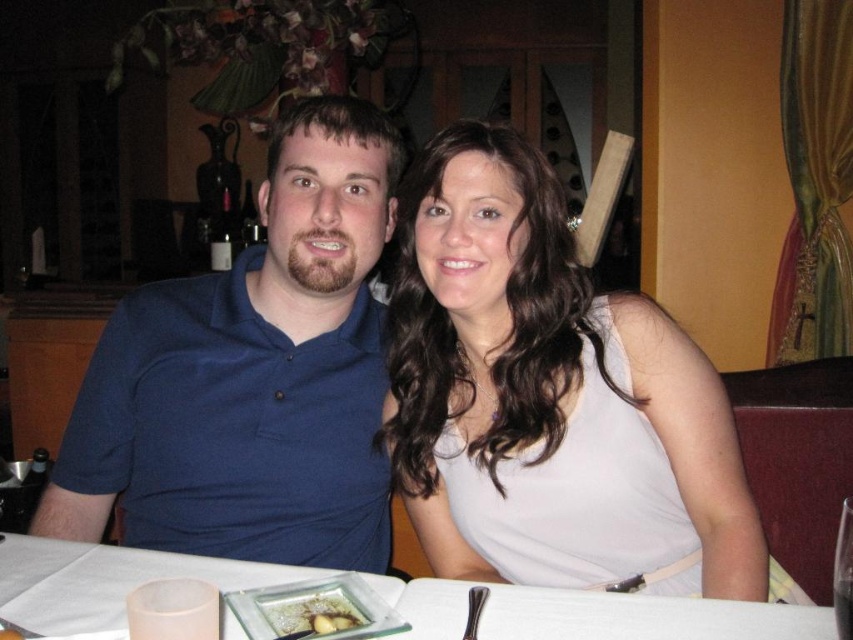
Question: Does slightly browned bread at center appear on the left side of transparent glass at table center?

Choices:
 (A) yes
 (B) no

Answer: (A)

Question: Considering the relative positions of matte white dress at center and white paper napkin at center in the image provided, where is matte white dress at center located with respect to white paper napkin at center?

Choices:
 (A) left
 (B) right

Answer: (B)

Question: Is blue cotton shirt at upper left bigger than white paper napkin at center?

Choices:
 (A) yes
 (B) no

Answer: (A)

Question: Among these objects, which one is farthest from the camera?

Choices:
 (A) white paper napkin at center
 (B) matte white dress at center
 (C) blue cotton polo shirt at left

Answer: (C)

Question: Which object is farther from the camera taking this photo?

Choices:
 (A) white paper napkin at center
 (B) slightly browned bread at center
 (C) blue cotton shirt at upper left

Answer: (C)

Question: Which object is farther from the camera taking this photo?

Choices:
 (A) white paper napkin at center
 (B) blue cotton polo shirt at left
 (C) transparent glass at table center

Answer: (B)